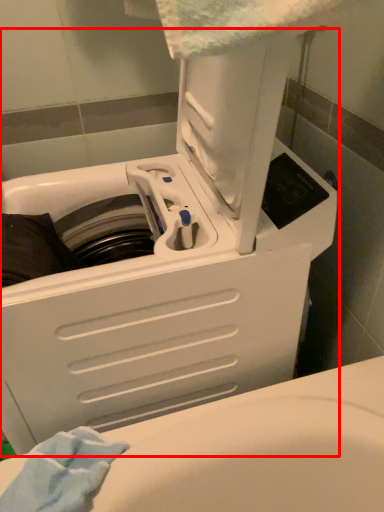
Question: From the image's perspective, what is the correct spatial positioning of washing machine (annotated by the red box) in reference to bath towel?

Choices:
 (A) above
 (B) below

Answer: (A)